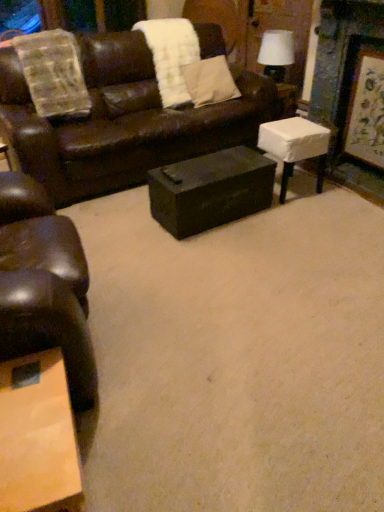
Question: Can you confirm if white fabric-covered stool at right, the 1th table viewed from the right, is positioned to the left of white fluffy blanket at upper center?

Choices:
 (A) yes
 (B) no

Answer: (B)

Question: Is white fluffy blanket at upper center located within white fabric-covered stool at right, the second table in the left-to-right sequence?

Choices:
 (A) yes
 (B) no

Answer: (B)

Question: Does white fabric-covered stool at right, the 1th table viewed from the right, lie in front of white fluffy blanket at upper center?

Choices:
 (A) yes
 (B) no

Answer: (A)

Question: Is white fabric-covered stool at right, the second table in the left-to-right sequence, facing away from white fluffy blanket at upper center?

Choices:
 (A) yes
 (B) no

Answer: (B)

Question: From the image's perspective, would you say white fabric-covered stool at right, the 1th table viewed from the right, is positioned over white fluffy blanket at upper center?

Choices:
 (A) yes
 (B) no

Answer: (B)

Question: From the image's perspective, is brown leather couch at upper center positioned above or below matte black trunk at center, the second table when ordered from right to left?

Choices:
 (A) above
 (B) below

Answer: (A)

Question: In terms of height, does brown leather couch at upper center look taller or shorter compared to matte black trunk at center, positioned as the 1th table in left-to-right order?

Choices:
 (A) tall
 (B) short

Answer: (A)

Question: From a real-world perspective, is brown leather couch at upper center above or below matte black trunk at center, positioned as the 1th table in left-to-right order?

Choices:
 (A) below
 (B) above

Answer: (B)

Question: Does point (233, 121) appear closer or farther from the camera than point (152, 216)?

Choices:
 (A) closer
 (B) farther

Answer: (B)

Question: Is point (49, 410) positioned closer to the camera than point (153, 31)?

Choices:
 (A) farther
 (B) closer

Answer: (B)

Question: Do you think wooden coffee table at lower left is within white fluffy blanket at upper center, or outside of it?

Choices:
 (A) inside
 (B) outside

Answer: (B)

Question: Is wooden coffee table at lower left bigger or smaller than white fluffy blanket at upper center?

Choices:
 (A) small
 (B) big

Answer: (A)

Question: From a real-world perspective, relative to white fluffy blanket at upper center, is wooden coffee table at lower left vertically above or below?

Choices:
 (A) below
 (B) above

Answer: (A)

Question: Considering the positions of point (203, 96) and point (182, 73), is point (203, 96) closer or farther from the camera than point (182, 73)?

Choices:
 (A) farther
 (B) closer

Answer: (A)

Question: Relative to white fluffy blanket at upper center, is beige fabric pillow at upper center in front or behind?

Choices:
 (A) front
 (B) behind

Answer: (B)